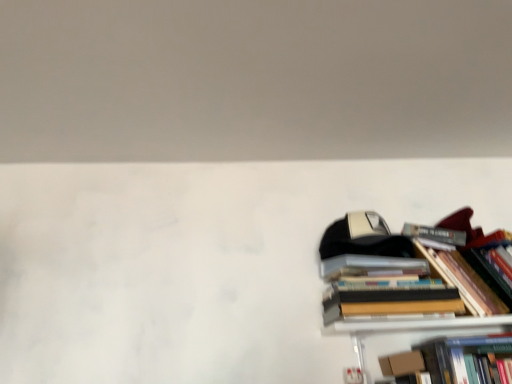
Question: Is point (452, 256) positioned closer to the camera than point (420, 362)?

Choices:
 (A) closer
 (B) farther

Answer: (B)

Question: Is hardcover books at right spatially inside hardcover book at lower right, or outside of it?

Choices:
 (A) outside
 (B) inside

Answer: (A)

Question: In the image, is hardcover books at right positioned in front of or behind hardcover book at lower right?

Choices:
 (A) front
 (B) behind

Answer: (A)

Question: Is point (419, 352) positioned closer to the camera than point (408, 299)?

Choices:
 (A) closer
 (B) farther

Answer: (B)

Question: Is hardcover book at lower right in front of or behind hardcover books at right in the image?

Choices:
 (A) front
 (B) behind

Answer: (B)

Question: In terms of size, does hardcover book at lower right appear bigger or smaller than hardcover books at right?

Choices:
 (A) big
 (B) small

Answer: (B)

Question: From a real-world perspective, is hardcover book at lower right above or below hardcover books at right?

Choices:
 (A) below
 (B) above

Answer: (A)